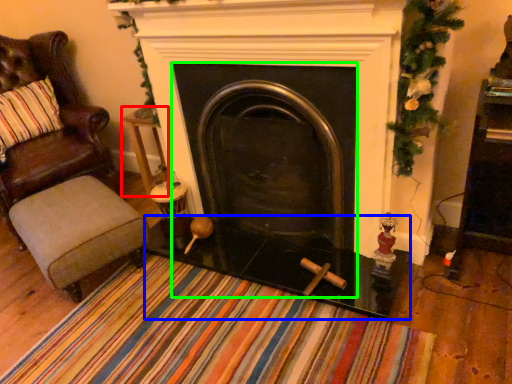
Question: Which is farther away from side table (highlighted by a red box)? glass table (highlighted by a blue box) or fireplace (highlighted by a green box)?

Choices:
 (A) glass table
 (B) fireplace

Answer: (A)